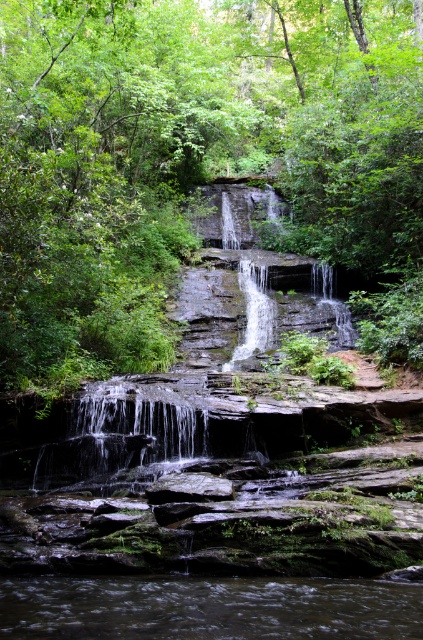
You are standing at the base of the waterfall and want to take a photo. There are two points marked in the scene, point A at coordinates point (420, 628) and point B at coordinates point (230, 358). Which point is closer to your camera lens?

Point point (420, 628) is closer to the camera than point point (230, 358), so point A is the closer one.

Looking at this image, you are standing at the base of the waterfall and want to take a photo of the green leafy tree at center. If your camera has a maximum focus range of 15 meters, will it be able to capture the tree clearly?

The green leafy tree at center and camera are 13.80 meters apart. Since the distance is within the camera maximum focus range of 15 meters, the camera can capture the tree clearly.